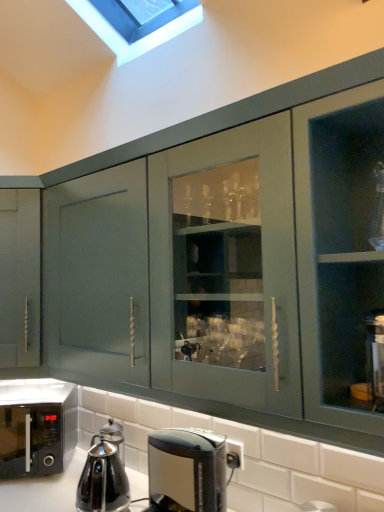
Question: Considering the relative sizes of stainless steel kettle at lower left and black glossy microwave at lower left in the image provided, is stainless steel kettle at lower left bigger than black glossy microwave at lower left?

Choices:
 (A) no
 (B) yes

Answer: (A)

Question: Can you confirm if stainless steel kettle at lower left is smaller than black glossy microwave at lower left?

Choices:
 (A) yes
 (B) no

Answer: (A)

Question: From a real-world perspective, is stainless steel kettle at lower left located beneath black glossy microwave at lower left?

Choices:
 (A) no
 (B) yes

Answer: (B)

Question: From the image's perspective, is stainless steel kettle at lower left on top of black glossy microwave at lower left?

Choices:
 (A) yes
 (B) no

Answer: (A)

Question: Does stainless steel kettle at lower left have a lesser width compared to black glossy microwave at lower left?

Choices:
 (A) no
 (B) yes

Answer: (B)

Question: Is black glossy microwave at lower left inside or outside of black glossy coffee maker at lower center?

Choices:
 (A) outside
 (B) inside

Answer: (A)

Question: Is black glossy microwave at lower left in front of or behind black glossy coffee maker at lower center in the image?

Choices:
 (A) behind
 (B) front

Answer: (A)

Question: Considering the positions of black glossy microwave at lower left and black glossy coffee maker at lower center in the image, is black glossy microwave at lower left taller or shorter than black glossy coffee maker at lower center?

Choices:
 (A) short
 (B) tall

Answer: (B)

Question: Looking at their shapes, would you say black glossy microwave at lower left is wider or thinner than black glossy coffee maker at lower center?

Choices:
 (A) thin
 (B) wide

Answer: (B)

Question: Would you say black glossy microwave at lower left is inside or outside stainless steel kettle at lower left?

Choices:
 (A) outside
 (B) inside

Answer: (A)

Question: From a real-world perspective, is black glossy microwave at lower left above or below stainless steel kettle at lower left?

Choices:
 (A) above
 (B) below

Answer: (A)

Question: From the image's perspective, is black glossy microwave at lower left located above or below stainless steel kettle at lower left?

Choices:
 (A) above
 (B) below

Answer: (B)

Question: In the image, is black glossy microwave at lower left positioned in front of or behind stainless steel kettle at lower left?

Choices:
 (A) front
 (B) behind

Answer: (B)

Question: From a real-world perspective, is black glossy coffee maker at lower center physically located above or below black glossy microwave at lower left?

Choices:
 (A) below
 (B) above

Answer: (B)

Question: In the image, is black glossy coffee maker at lower center positioned in front of or behind black glossy microwave at lower left?

Choices:
 (A) behind
 (B) front

Answer: (B)